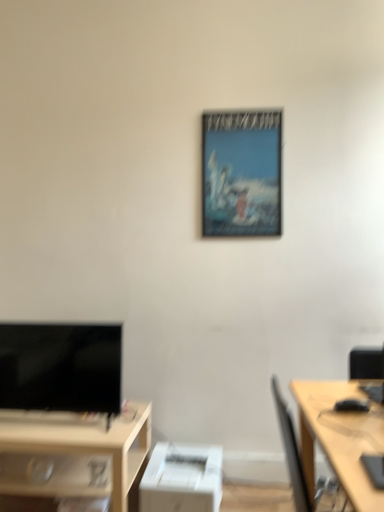
What do you see at coordinates (61, 367) in the screenshot? I see `black glossy tv at lower left` at bounding box center [61, 367].

Image resolution: width=384 pixels, height=512 pixels. What do you see at coordinates (340, 437) in the screenshot?
I see `light wood desk at right, which is counted as the second desk, starting from the bottom` at bounding box center [340, 437].

Describe the element at coordinates (242, 173) in the screenshot. I see `metallic poster at center` at that location.

The height and width of the screenshot is (512, 384). I want to click on white matte printer at lower center, so click(x=182, y=479).

How distant is matte white desk at lower left, arranged as the 1th desk when ordered from the bottom, from black glossy tv at lower left?

9.30 inches.

Between matte white desk at lower left, the 2th desk when ordered from top to bottom, and black glossy tv at lower left, which one has larger size?

Bigger between the two is matte white desk at lower left, the 2th desk when ordered from top to bottom.

Based on the photo, which is further, (x=82, y=490) or (x=110, y=389)?

The point (x=110, y=389) is farther from the camera.

There is a black glossy tv at lower left. Identify the location of the 2nd desk below it (from the image's perspective). point(73,453).

Based on the photo, is metallic poster at center further to the viewer compared to black glossy tv at lower left?

Yes, it is.

Is metallic poster at center far away from black glossy tv at lower left?

metallic poster at center is far away from black glossy tv at lower left.

Considering the relative positions of metallic poster at center and black glossy tv at lower left in the image provided, is metallic poster at center to the left of black glossy tv at lower left from the viewer's perspective?

No.

From a real-world perspective, which is physically above, metallic poster at center or black glossy tv at lower left?

metallic poster at center.

Does white matte printer at lower center have a smaller size compared to black glossy tv at lower left?

Correct, white matte printer at lower center occupies less space than black glossy tv at lower left.

Does white matte printer at lower center have a greater width compared to black glossy tv at lower left?

Indeed, white matte printer at lower center has a greater width compared to black glossy tv at lower left.

Between white matte printer at lower center and black glossy tv at lower left, which one has less height?

Standing shorter between the two is white matte printer at lower center.

Considering the positions of objects light wood desk at right, placed as the 1th desk when sorted from top to bottom, and matte white desk at lower left, the first desk when ordered from back to front, in the image provided, who is behind, light wood desk at right, placed as the 1th desk when sorted from top to bottom, or matte white desk at lower left, the first desk when ordered from back to front,?

Positioned behind is matte white desk at lower left, the first desk when ordered from back to front.

Is light wood desk at right, placed as the 1th desk when sorted from top to bottom, outside of matte white desk at lower left, arranged as the 1th desk when ordered from the bottom?

light wood desk at right, placed as the 1th desk when sorted from top to bottom, is positioned outside matte white desk at lower left, arranged as the 1th desk when ordered from the bottom.

Locate an element on the screen. The height and width of the screenshot is (512, 384). desk below the light wood desk at right, which is counted as the second desk, starting from the bottom (from a real-world perspective) is located at coordinates (73, 453).

From the picture: From the image's perspective, which is above, black glossy tv at lower left or metallic poster at center?

metallic poster at center, from the image's perspective.

Is black glossy tv at lower left positioned with its back to metallic poster at center?

No, black glossy tv at lower left is not facing the opposite direction of metallic poster at center.

Is black glossy tv at lower left directly adjacent to metallic poster at center?

No, black glossy tv at lower left is not next to metallic poster at center.

Which of these two, white matte printer at lower center or metallic poster at center, is bigger?

white matte printer at lower center is bigger.

From a real-world perspective, is white matte printer at lower center on top of metallic poster at center?

No.

Is white matte printer at lower center next to metallic poster at center?

white matte printer at lower center is not next to metallic poster at center, and they're not touching.

Which is in front, white matte printer at lower center or metallic poster at center?

white matte printer at lower center is more forward.

Is metallic poster at center with white matte printer at lower center?

No, metallic poster at center is not touching white matte printer at lower center.

Consider the image. Which object is wider, metallic poster at center or white matte printer at lower center?

white matte printer at lower center.

Based on the photo, is metallic poster at center positioned behind white matte printer at lower center?

Yes, metallic poster at center is behind white matte printer at lower center.

Identify the location of television above the matte white desk at lower left, the 2th desk when ordered from top to bottom (from the image's perspective). This screenshot has width=384, height=512. [61, 367].

Locate an element on the screen. This screenshot has width=384, height=512. picture frame lying behind the black glossy tv at lower left is located at coordinates (242, 173).

Considering their positions, is matte white desk at lower left, arranged as the 1th desk when ordered from the bottom, positioned closer to light wood desk at right, which is the first desk from right to left, than white matte printer at lower center?

white matte printer at lower center.

When comparing their distances from light wood desk at right, which is counted as the second desk, starting from the bottom, does white matte printer at lower center or matte white desk at lower left, placed as the second desk when sorted from front to back, seem further?

matte white desk at lower left, placed as the second desk when sorted from front to back, lies further to light wood desk at right, which is counted as the second desk, starting from the bottom, than the other object.

From the picture: Considering their positions, is matte white desk at lower left, which ranks as the first desk in left-to-right order, positioned closer to black glossy tv at lower left than metallic poster at center?

Among the two, matte white desk at lower left, which ranks as the first desk in left-to-right order, is located nearer to black glossy tv at lower left.

Looking at the image, which one is located further to metallic poster at center, matte white desk at lower left, which ranks as the first desk in left-to-right order, or light wood desk at right, the 1th desk viewed from the front?

matte white desk at lower left, which ranks as the first desk in left-to-right order, lies further to metallic poster at center than the other object.

Based on their spatial positions, is light wood desk at right, which is counted as the second desk, starting from the bottom, or matte white desk at lower left, the first desk when ordered from back to front, further from black glossy tv at lower left?

light wood desk at right, which is counted as the second desk, starting from the bottom, lies further to black glossy tv at lower left than the other object.

When comparing their distances from white matte printer at lower center, does metallic poster at center or light wood desk at right, the 1th desk viewed from the front, seem further?

Based on the image, metallic poster at center appears to be further to white matte printer at lower center.

Looking at the image, which one is located closer to black glossy tv at lower left, metallic poster at center or light wood desk at right, marked as the 2th desk in a left-to-right arrangement?

metallic poster at center lies closer to black glossy tv at lower left than the other object.

From the image, which object appears to be farther from matte white desk at lower left, arranged as the 1th desk when ordered from the bottom, white matte printer at lower center or light wood desk at right, which is counted as the second desk, starting from the bottom?

The object further to matte white desk at lower left, arranged as the 1th desk when ordered from the bottom, is light wood desk at right, which is counted as the second desk, starting from the bottom.

This screenshot has width=384, height=512. What are the coordinates of `television between metallic poster at center and matte white desk at lower left, arranged as the 1th desk when ordered from the bottom, in the vertical direction` in the screenshot? It's located at (61, 367).

I want to click on television between light wood desk at right, placed as the 1th desk when sorted from top to bottom, and metallic poster at center in the front-back direction, so click(x=61, y=367).

Locate an element on the screen. The height and width of the screenshot is (512, 384). desk between metallic poster at center and matte white desk at lower left, the 2th desk when ordered from top to bottom, in the vertical direction is located at coordinates (340, 437).

Identify the location of desk between light wood desk at right, positioned as the 2th desk in back-to-front order, and white matte printer at lower center, along the z-axis. This screenshot has height=512, width=384. (73, 453).